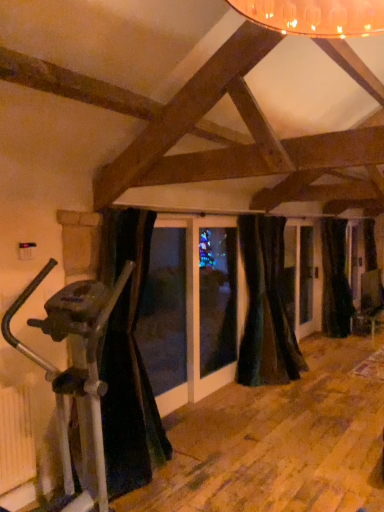
Question: Is black velvet curtain at right, the 1th curtain positioned from the back, oriented away from velvet dark green curtain at center, the 2th curtain when ordered from front to back?

Choices:
 (A) yes
 (B) no

Answer: (B)

Question: Considering the relative sizes of black velvet curtain at right, which is the 3th curtain from left to right, and velvet dark green curtain at center, acting as the 2th curtain starting from the left, in the image provided, is black velvet curtain at right, which is the 3th curtain from left to right, shorter than velvet dark green curtain at center, acting as the 2th curtain starting from the left,?

Choices:
 (A) yes
 (B) no

Answer: (B)

Question: From the image's perspective, is black velvet curtain at right, the 1th curtain positioned from the right, located beneath velvet dark green curtain at center, acting as the 2th curtain starting from the left?

Choices:
 (A) yes
 (B) no

Answer: (B)

Question: Is black velvet curtain at right, acting as the third curtain starting from the front, further to the viewer compared to velvet dark green curtain at center, the second curtain from the back?

Choices:
 (A) yes
 (B) no

Answer: (A)

Question: From the image's perspective, is black velvet curtain at right, which is the 3th curtain from left to right, over velvet dark green curtain at center, positioned as the 2th curtain in right-to-left order?

Choices:
 (A) no
 (B) yes

Answer: (B)

Question: Do you think velvet dark green curtain at center, the 2th curtain when ordered from front to back, is within black velvet curtain at right, the 1th curtain positioned from the right, or outside of it?

Choices:
 (A) outside
 (B) inside

Answer: (A)

Question: Looking at their shapes, would you say velvet dark green curtain at center, the 2th curtain when ordered from front to back, is wider or thinner than black velvet curtain at right, the 1th curtain positioned from the back?

Choices:
 (A) thin
 (B) wide

Answer: (B)

Question: In terms of size, does velvet dark green curtain at center, acting as the 2th curtain starting from the left, appear bigger or smaller than black velvet curtain at right, the 1th curtain positioned from the right?

Choices:
 (A) small
 (B) big

Answer: (B)

Question: Relative to black velvet curtain at right, the 1th curtain positioned from the right, is velvet dark green curtain at center, the second curtain from the back, in front or behind?

Choices:
 (A) behind
 (B) front

Answer: (B)

Question: Considering the relative positions of black velvet curtain at left, marked as the 1th curtain in a front-to-back arrangement, and silver metallic stationary bicycle at left in the image provided, is black velvet curtain at left, marked as the 1th curtain in a front-to-back arrangement, to the left or to the right of silver metallic stationary bicycle at left?

Choices:
 (A) right
 (B) left

Answer: (A)

Question: Looking at the image, does black velvet curtain at left, marked as the third curtain in a back-to-front arrangement, seem bigger or smaller compared to silver metallic stationary bicycle at left?

Choices:
 (A) big
 (B) small

Answer: (B)

Question: Is black velvet curtain at left, the 1th curtain from the left, wider or thinner than silver metallic stationary bicycle at left?

Choices:
 (A) thin
 (B) wide

Answer: (A)

Question: Is point (105, 216) positioned closer to the camera than point (56, 394)?

Choices:
 (A) closer
 (B) farther

Answer: (B)

Question: From the image's perspective, is black velvet curtain at left, the 1th curtain from the left, positioned above or below black velvet curtain at right, the 1th curtain positioned from the back?

Choices:
 (A) above
 (B) below

Answer: (B)

Question: Is black velvet curtain at left, marked as the third curtain in a back-to-front arrangement, in front of or behind black velvet curtain at right, which is the 3th curtain from left to right, in the image?

Choices:
 (A) front
 (B) behind

Answer: (A)